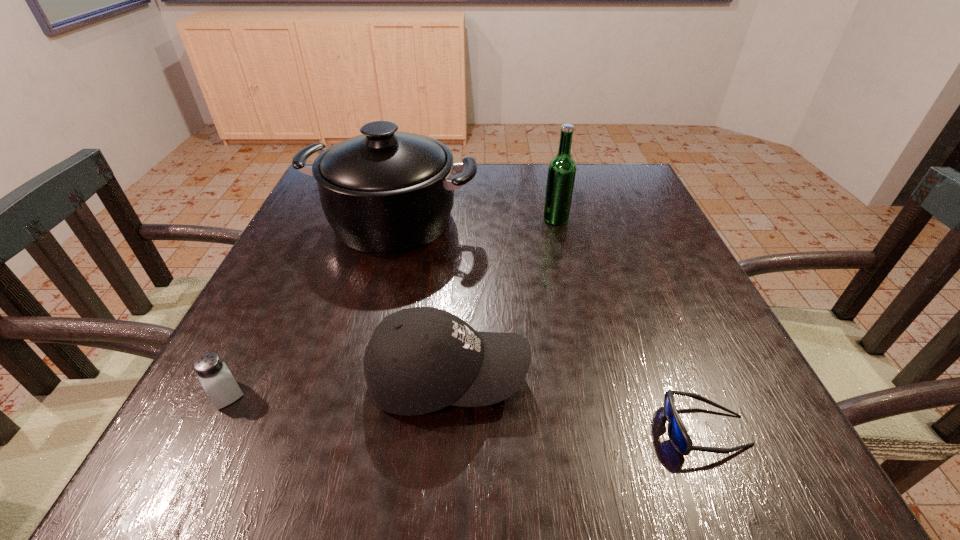
You are a GUI agent. You are given a task and a screenshot of the screen. Output one action in this format:
    pyautogui.click(x=<x>, y=<y>)
    Task: Click on the object at the near right corner
    The width and height of the screenshot is (960, 540).
    Given the screenshot: What is the action you would take?
    pyautogui.click(x=677, y=433)

In the image, there is a desktop. At what (x,y) coordinates should I click in order to perform the action: click on vacant space at the far edge. Please return your answer as a coordinate pair (x, y). This screenshot has height=540, width=960. Looking at the image, I should click on (541, 186).

This screenshot has height=540, width=960. I want to click on vacant space at the near edge of the desktop, so click(x=488, y=423).

In the image, there is a desktop. Where is `free space at the left edge`? This screenshot has width=960, height=540. free space at the left edge is located at coordinates (255, 309).

The image size is (960, 540). In the image, there is a desktop. Find the location of `vacant space at the right edge`. vacant space at the right edge is located at coordinates (607, 231).

The height and width of the screenshot is (540, 960). In the image, there is a desktop. In order to click on vacant space at the near left corner in this screenshot , I will do (x=273, y=444).

At what (x,y) coordinates should I click in order to perform the action: click on vacant space at the far right corner of the desktop. Please return your answer as a coordinate pair (x, y). Image resolution: width=960 pixels, height=540 pixels. Looking at the image, I should click on (598, 201).

Locate an element on the screen. vacant space at the near right corner of the desktop is located at coordinates (732, 438).

Where is `free space that is in between the second shortest object and the beer bottle`? This screenshot has width=960, height=540. free space that is in between the second shortest object and the beer bottle is located at coordinates (391, 307).

What are the coordinates of `free spot between the fourth object from left to right and the fourth tallest object` in the screenshot? It's located at (391, 307).